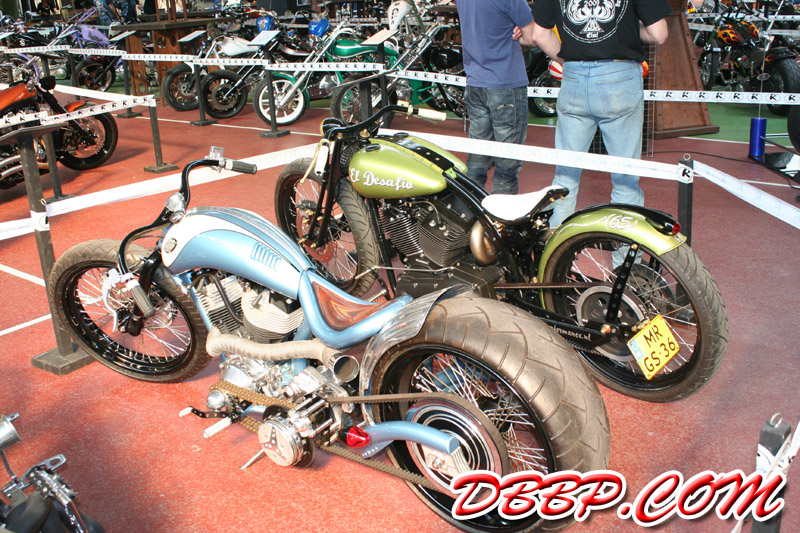
At what (x,y) coordinates should I click in order to perform the action: click on floor. Please return your answer as a coordinate pair (x, y). The width and height of the screenshot is (800, 533). Looking at the image, I should click on (166, 472).